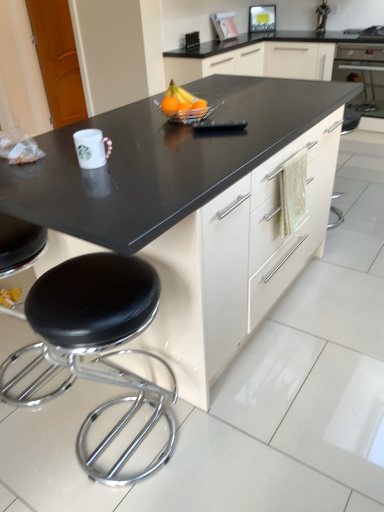
Question: From a real-world perspective, is black leather stool at lower left positioned above or below orange matte at center, the first orange from the right?

Choices:
 (A) below
 (B) above

Answer: (A)

Question: From their relative heights in the image, would you say black leather stool at lower left is taller or shorter than orange matte at center, which appears as the second orange when viewed from the left?

Choices:
 (A) short
 (B) tall

Answer: (B)

Question: Which object is the closest to the black glossy oven at upper right?

Choices:
 (A) orange matte at center, the first orange from the right
 (B) glossy plastic bowl at center
 (C) black leather stool at lower left
 (D) orange matte at center, positioned as the first orange in left-to-right order

Answer: (B)

Question: Which object is positioned farthest from the black glossy oven at upper right?

Choices:
 (A) orange matte at center, which appears as the second orange when viewed from the left
 (B) black leather stool at lower left
 (C) orange matte at center, positioned as the 2th orange in right-to-left order
 (D) glossy plastic bowl at center

Answer: (B)